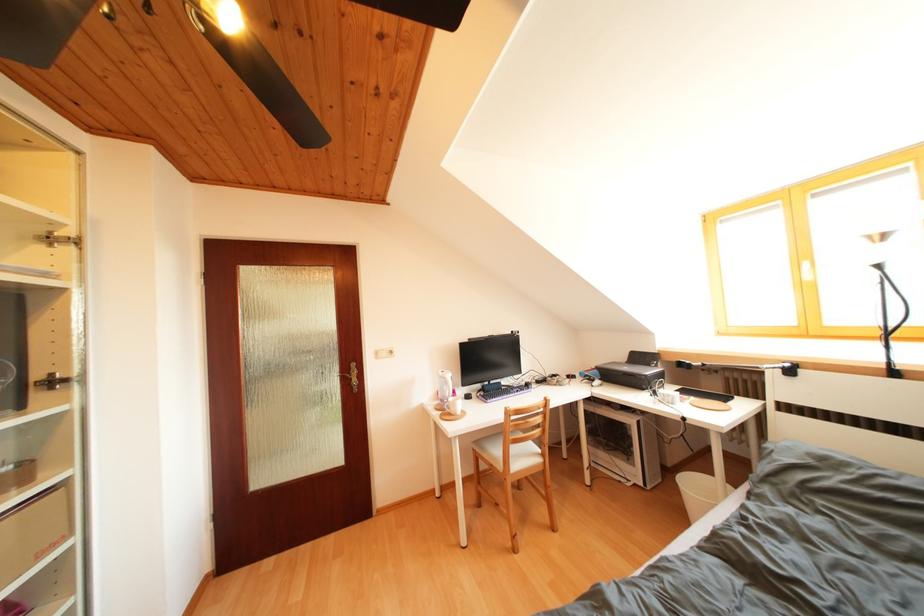
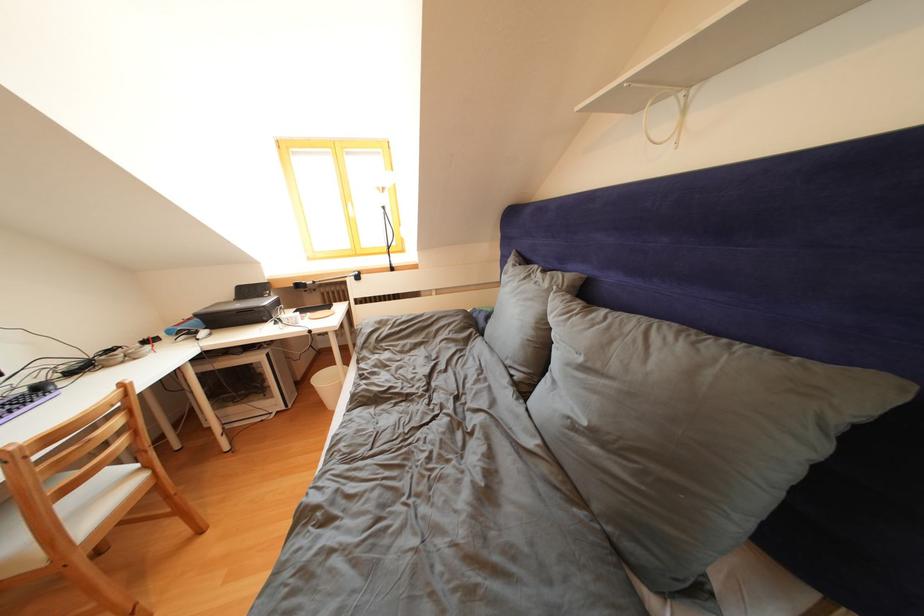
Consider the image. First-person continuous shooting, in which direction is the camera rotating?

The camera's rotation is toward right-down.